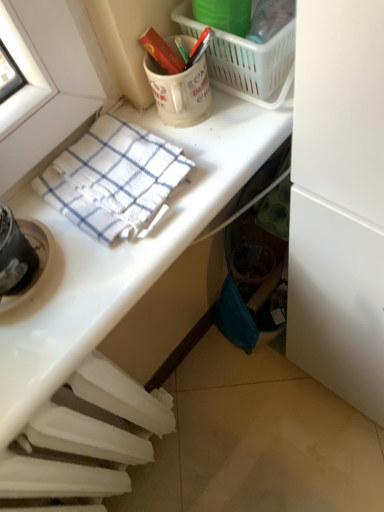
Where is `free space in front of white plastic picnic basket at upper center`? This screenshot has height=512, width=384. free space in front of white plastic picnic basket at upper center is located at coordinates (242, 132).